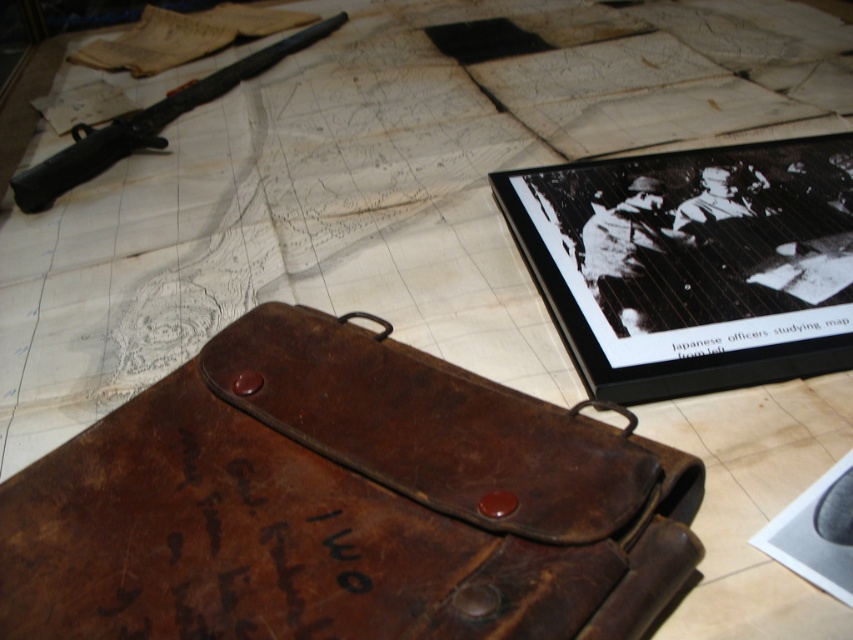
Does leather case at center lie in front of black matte rifle at upper left?

Yes, it is in front of black matte rifle at upper left.

Does leather case at center have a larger size compared to black matte rifle at upper left?

No, leather case at center is not bigger than black matte rifle at upper left.

The width and height of the screenshot is (853, 640). In order to click on leather case at center in this screenshot , I will do (x=341, y=504).

Find the location of a particular element. The width and height of the screenshot is (853, 640). leather case at center is located at coordinates (341, 504).